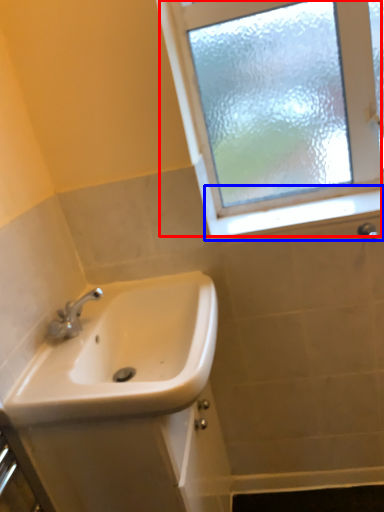
Question: Among these objects, which one is nearest to the camera, window (highlighted by a red box) or window sill (highlighted by a blue box)?

Choices:
 (A) window
 (B) window sill

Answer: (A)